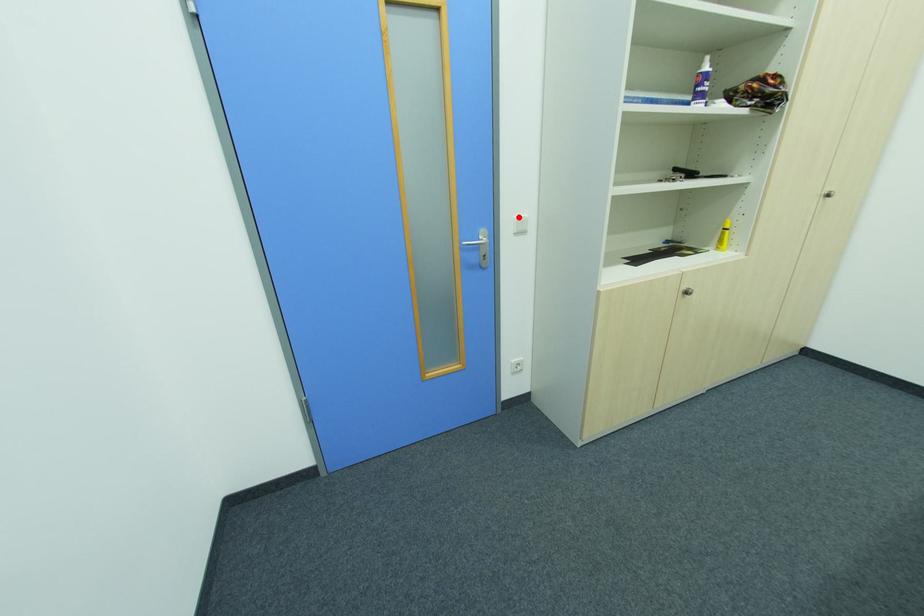
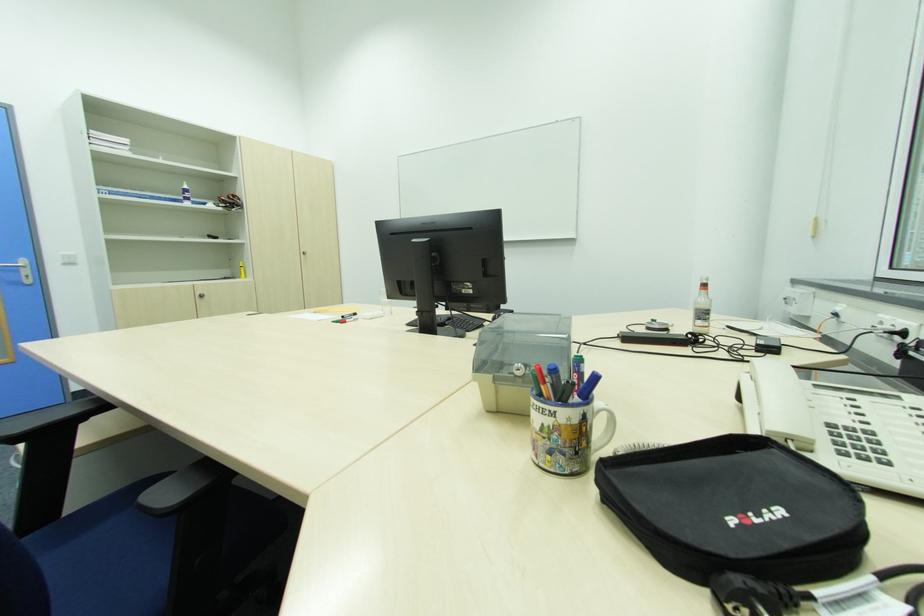
Where in the second image is the point corresponding to the highlighted location from the first image?

(64, 254)